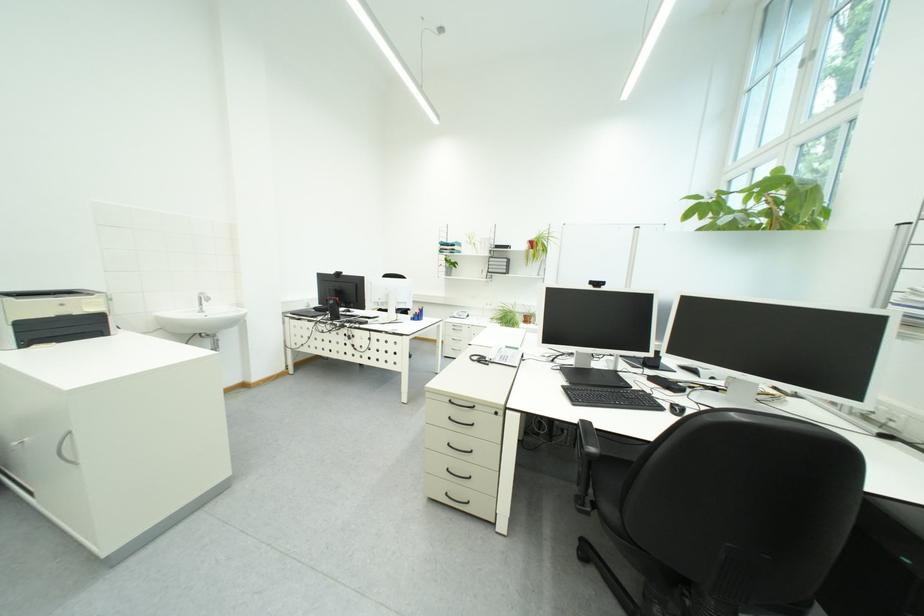
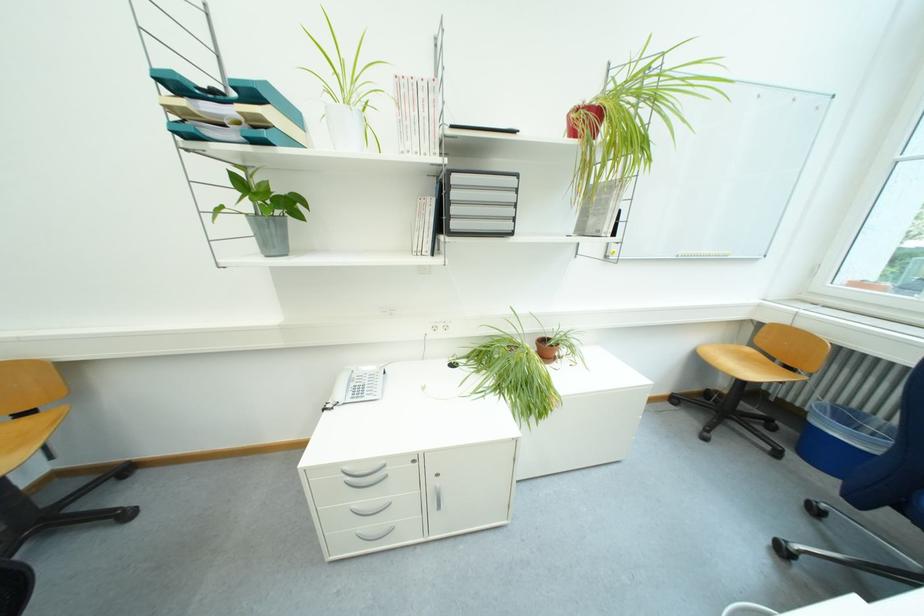
Locate, in the second image, the point that corresponds to pixel 467 315 in the first image.

(351, 395)